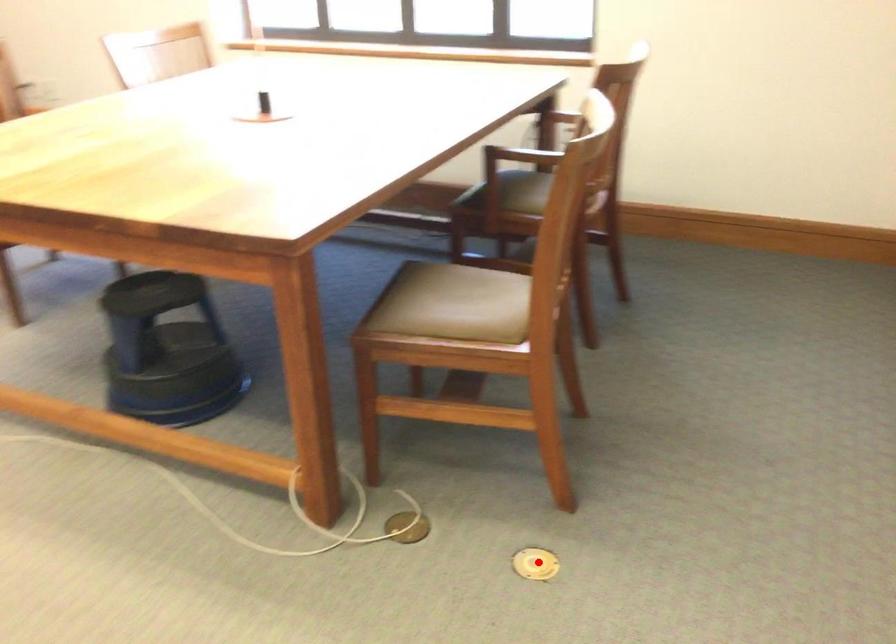
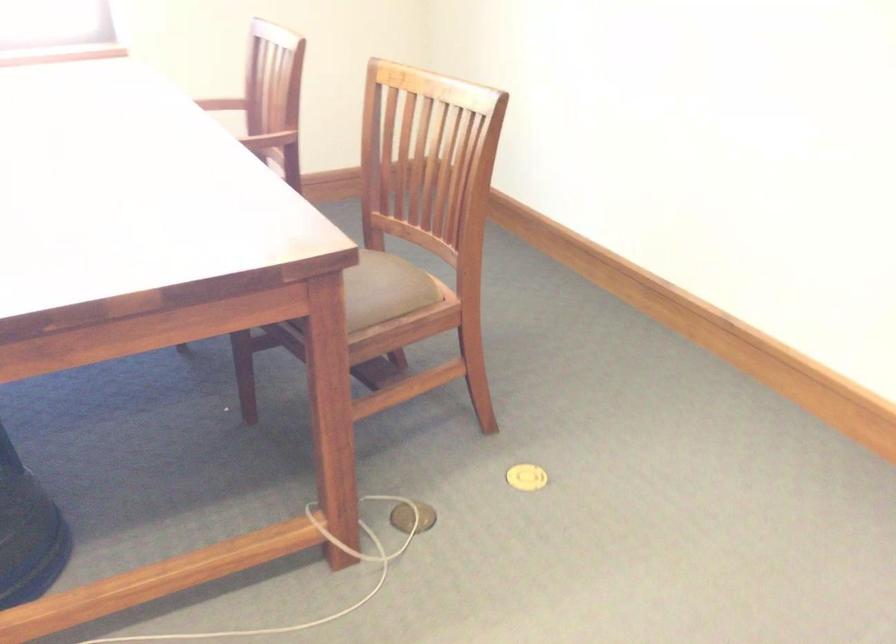
Question: I am providing you with two images of the same scene from different viewpoints. Image1 has a red point marked. In image2, the corresponding 3D location appears at what relative position? Reply with the corresponding letter.

Choices:
 (A) Closer
 (B) Farther

Answer: (B)